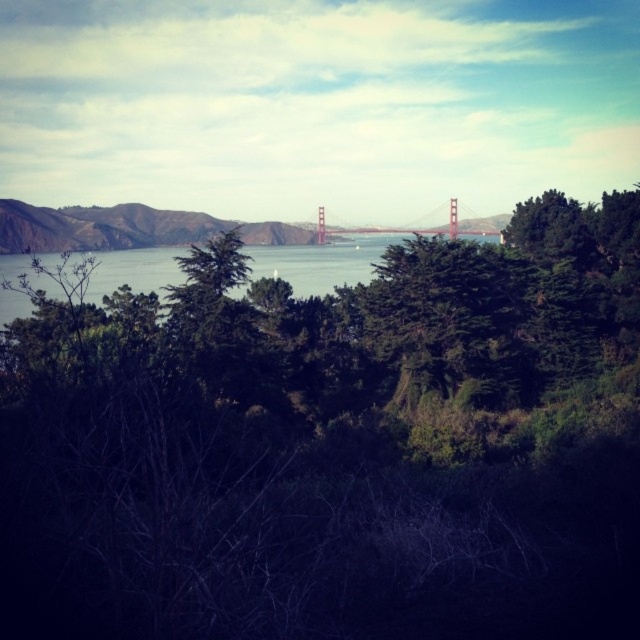
You are a photographer planning to capture the Golden Gate Bridge from a viewpoint where the blue water at center and the metallic golden bridge at center are both visible. Based on the scene description, which object is positioned to the left of the other?

The blue water at center is to the left of the metallic golden bridge at center.

You are a photographer aiming to capture the Golden Gate Bridge without any obstructions. You notice the green leafy tree at center and the metallic golden bridge at center in your viewfinder. Which object should you move your camera to avoid blocking the view of the bridge?

The green leafy tree at center is in front of the metallic golden bridge at center. To avoid blocking the view of the bridge, you should move your camera to the side or angle it away from the green leafy tree at center so that the metallic golden bridge at center becomes visible without obstruction.

You are a photographer trying to capture the Golden Gate Bridge in the background. You notice a green leafy tree at center and a metallic golden bridge at center. Which object is bigger in the photo?

The green leafy tree at center is larger in size than the metallic golden bridge at center in the photo.